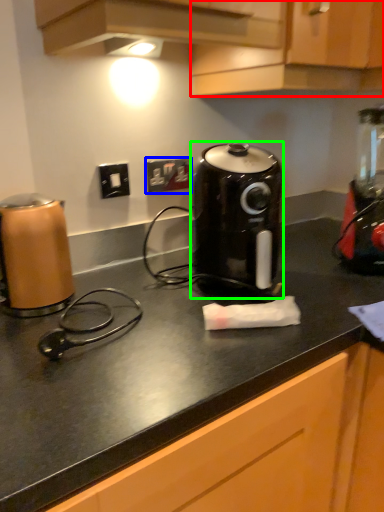
Question: Based on their relative distances, which object is nearer to cabinetry (highlighted by a red box)? Choose from electric outlet (highlighted by a blue box) and kitchen appliance (highlighted by a green box).

Choices:
 (A) electric outlet
 (B) kitchen appliance

Answer: (B)